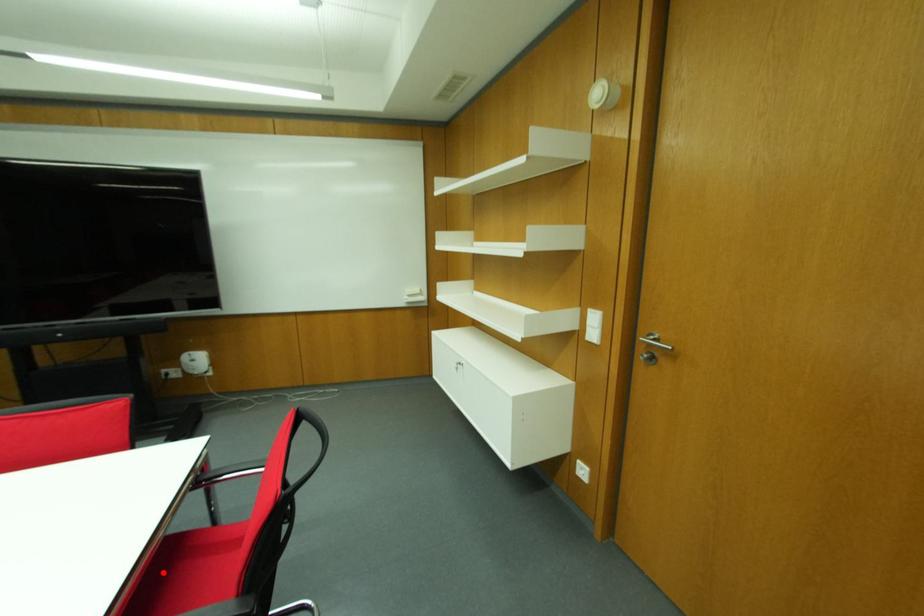
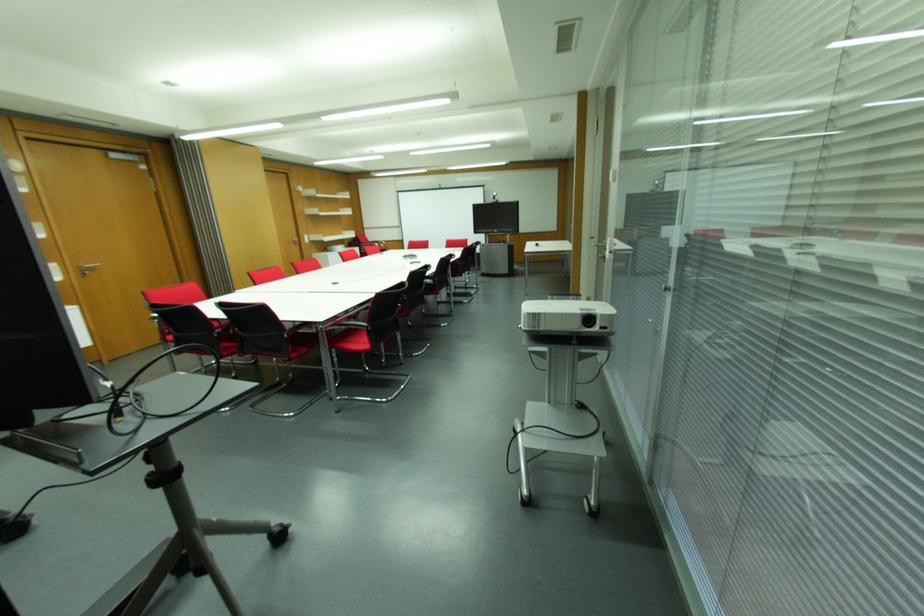
Question: I am providing you with two images of the same scene from different viewpoints. A red point is marked on the first image. Can you still see the location of the red point in image 2?

Choices:
 (A) Yes
 (B) No

Answer: (B)